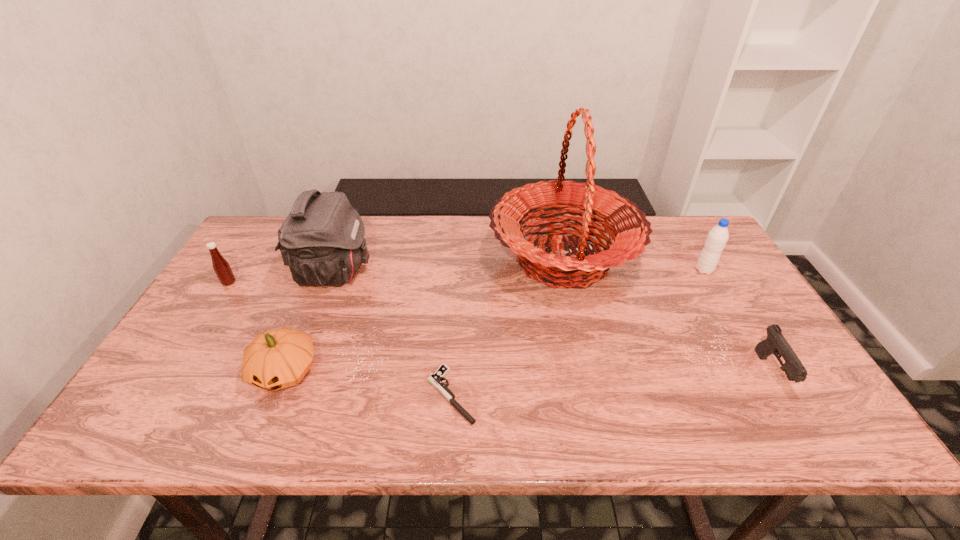
Where is `vacant area at the far right corner of the desktop`? This screenshot has height=540, width=960. vacant area at the far right corner of the desktop is located at coordinates (658, 229).

You are a GUI agent. You are given a task and a screenshot of the screen. Output one action in this format:
    pyautogui.click(x=<x>, y=<y>)
    Task: Click on the empty location between the taller pistol and the Tabasco sauce
    This screenshot has height=540, width=960.
    Given the screenshot: What is the action you would take?
    pyautogui.click(x=500, y=328)

This screenshot has width=960, height=540. In order to click on vacant area between the sixth tallest object and the second tallest object in this screenshot , I will do `click(553, 322)`.

Locate an element on the screen. The height and width of the screenshot is (540, 960). free space between the taller pistol and the third object from right to left is located at coordinates (667, 316).

Where is `vacant space in between the fifth shortest object and the left pistol`? This screenshot has width=960, height=540. vacant space in between the fifth shortest object and the left pistol is located at coordinates (578, 332).

Where is `vacant area that lies between the basket and the taller pistol`? This screenshot has height=540, width=960. vacant area that lies between the basket and the taller pistol is located at coordinates (667, 316).

Find the location of a particular element. The width and height of the screenshot is (960, 540). unoccupied position between the basket and the gourd is located at coordinates (423, 316).

You are a GUI agent. You are given a task and a screenshot of the screen. Output one action in this format:
    pyautogui.click(x=<x>, y=<y>)
    Task: Click on the vacant region between the basket and the gourd
    Image resolution: width=960 pixels, height=540 pixels.
    Given the screenshot: What is the action you would take?
    pyautogui.click(x=423, y=316)

The height and width of the screenshot is (540, 960). In order to click on vacant space in between the basket and the gourd in this screenshot , I will do `click(423, 316)`.

The image size is (960, 540). I want to click on unoccupied area between the gourd and the second tallest object, so click(309, 322).